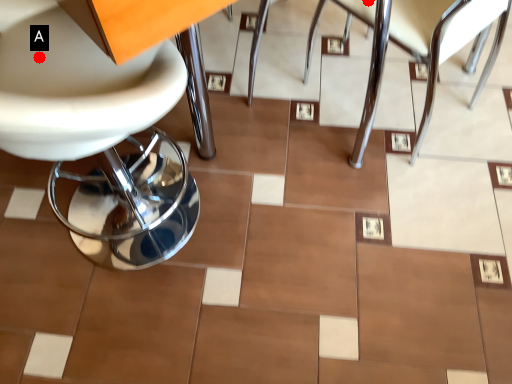
Question: Two points are circled on the image, labeled by A and B beside each circle. Among these points, which one is nearest to the camera?

Choices:
 (A) A is closer
 (B) B is closer

Answer: (A)